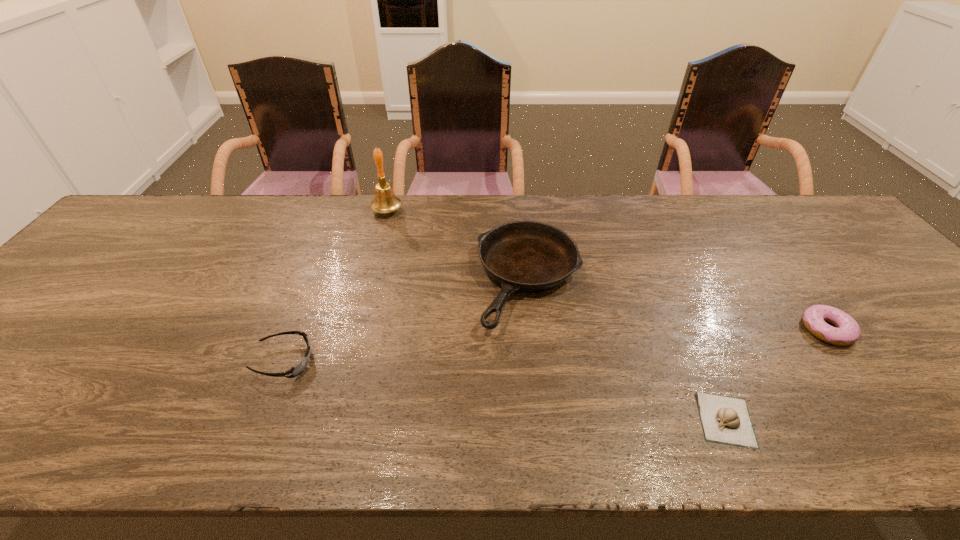
Identify the location of vacant space that's between the garlic and the tallest object. This screenshot has height=540, width=960. (557, 315).

The image size is (960, 540). I want to click on free area in between the rightmost object and the fourth shortest object, so click(x=678, y=305).

I want to click on free space between the bell and the second tallest object, so click(x=458, y=246).

Identify the location of free spot between the tallest object and the third object from right to left. (458, 246).

The image size is (960, 540). Find the location of `free spot between the sunglasses and the second tallest object`. free spot between the sunglasses and the second tallest object is located at coordinates (407, 321).

You are a GUI agent. You are given a task and a screenshot of the screen. Output one action in this format:
    pyautogui.click(x=<x>, y=<y>)
    Task: Click on the free area in between the garlic and the frying pan
    This screenshot has width=960, height=540.
    Given the screenshot: What is the action you would take?
    pyautogui.click(x=628, y=350)

The image size is (960, 540). Find the location of `free area in between the sunglasses and the rightmost object`. free area in between the sunglasses and the rightmost object is located at coordinates (556, 345).

Find the location of a particular element. Image resolution: width=960 pixels, height=540 pixels. free space between the tallest object and the doughnut is located at coordinates (607, 271).

Where is `unoccupied area between the rightmost object and the bell`? This screenshot has height=540, width=960. unoccupied area between the rightmost object and the bell is located at coordinates (607, 271).

The height and width of the screenshot is (540, 960). In order to click on vacant area that lies between the fourth shortest object and the bell in this screenshot , I will do `click(458, 246)`.